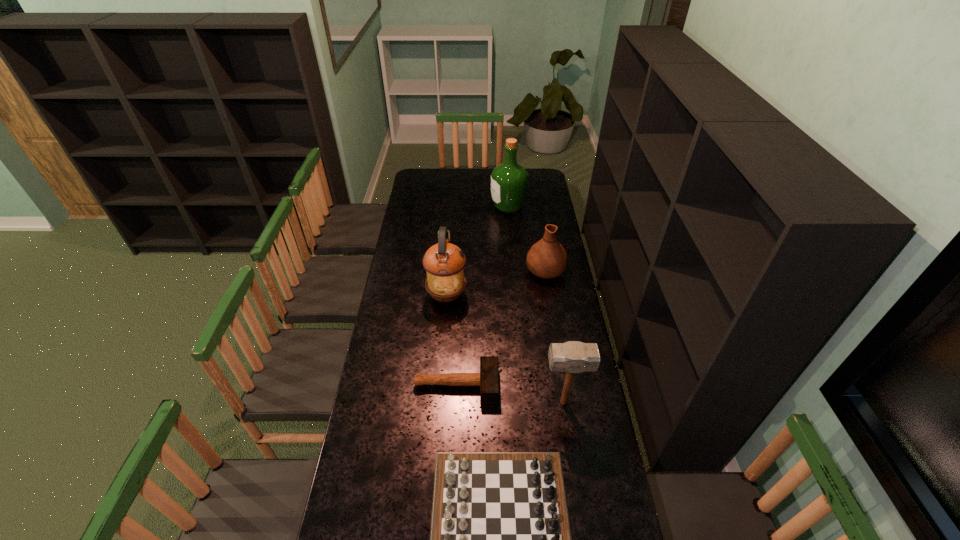
Image resolution: width=960 pixels, height=540 pixels. In the image, there is a desktop. Identify the location of vacant space at the left edge. [394, 378].

In the image, there is a desktop. Where is `free region at the right edge`? free region at the right edge is located at coordinates (x=527, y=211).

Find the location of a particular element. The height and width of the screenshot is (540, 960). vacant area that lies between the taller mallet and the oil lamp is located at coordinates (505, 349).

Image resolution: width=960 pixels, height=540 pixels. I want to click on free space between the shorter mallet and the pitcher, so click(x=501, y=327).

This screenshot has height=540, width=960. Identify the location of free space between the oil lamp and the shortest object. (451, 340).

What are the coordinates of `empty location between the taller mallet and the shortest object` in the screenshot? It's located at (510, 394).

Locate an element on the screen. The image size is (960, 540). vacant region between the liquor and the shortest object is located at coordinates (482, 296).

Locate an element on the screen. The width and height of the screenshot is (960, 540). free area in between the farthest object and the fourth tallest object is located at coordinates (527, 238).

Locate an element on the screen. This screenshot has width=960, height=540. empty space that is in between the oil lamp and the right mallet is located at coordinates (505, 349).

You are a GUI agent. You are given a task and a screenshot of the screen. Output one action in this format:
    pyautogui.click(x=<x>, y=<y>)
    Task: Click on the object that is the fifth closest to the oil lamp
    This screenshot has width=960, height=540.
    Given the screenshot: What is the action you would take?
    pyautogui.click(x=500, y=539)